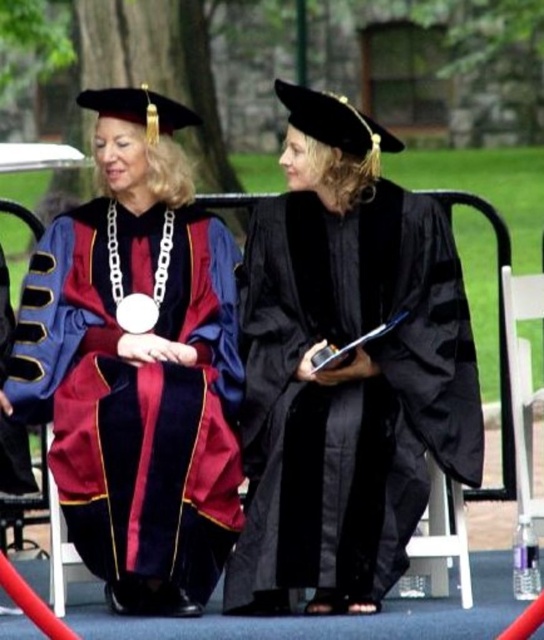
Question: Which of the following is the closest to the observer?

Choices:
 (A) (134, 188)
 (B) (290, 252)

Answer: (B)

Question: In this image, where is maroon velvet gown at center located relative to black matte graduation gown at center?

Choices:
 (A) right
 (B) left

Answer: (B)

Question: Which point appears closest to the camera in this image?

Choices:
 (A) (127, 131)
 (B) (336, 243)

Answer: (B)

Question: Does maroon velvet gown at center have a greater width compared to black matte graduation gown at center?

Choices:
 (A) yes
 (B) no

Answer: (B)

Question: Which of the following is the farthest from the observer?

Choices:
 (A) (400, 442)
 (B) (162, 506)

Answer: (A)

Question: Is the position of maroon velvet gown at center less distant than that of black matte graduation gown at center?

Choices:
 (A) no
 (B) yes

Answer: (A)